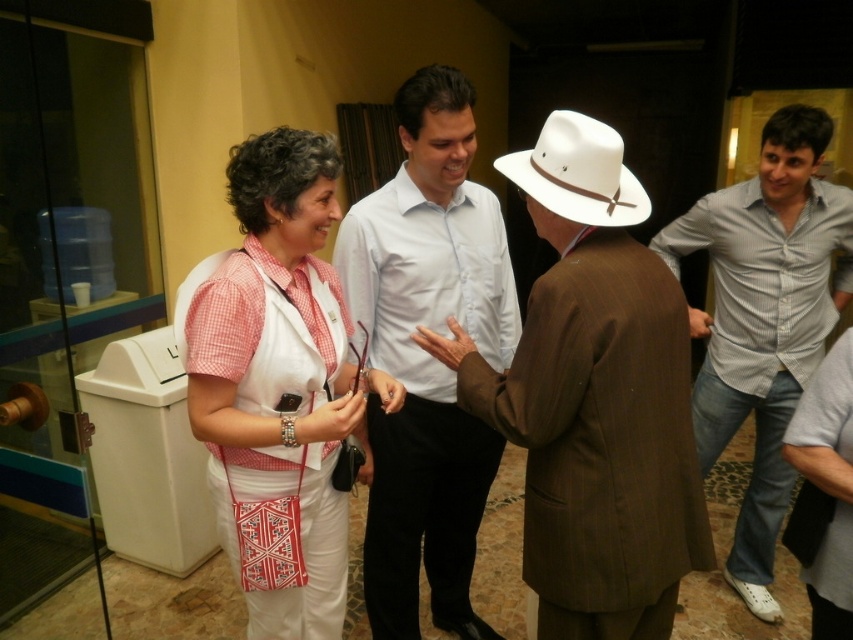
You are a photographer at the event and want to capture a photo of the two people in the white woven vest at center and light blue shirt at center. Which one should you focus on first if you want to include both in the frame without moving the camera?

The white woven vest at center is located below the light blue shirt at center, so you should focus on the light blue shirt at center first as it is higher up and easier to frame without adjusting the camera position.

You are an event planner organizing a photo shoot in the museum. You need to position two participants wearing the light blue striped shirt at right and the gray cotton shirt at right. Which shirt should you choose if you want the participant to appear more prominent in the group photo?

The light blue striped shirt at right is larger in size than the gray cotton shirt at right, so choosing the participant wearing the light blue striped shirt at right would make them appear more prominent in the group photo.